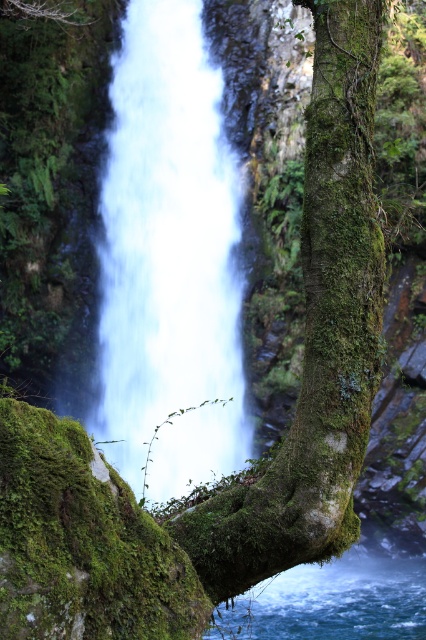
Between white frothy water at center and clear blue water at lower center, which one is positioned lower?

clear blue water at lower center

The height and width of the screenshot is (640, 426). Describe the element at coordinates (169, 259) in the screenshot. I see `white frothy water at center` at that location.

Between point (196, 326) and point (359, 570), which one is positioned in front?

Point (359, 570) is in front.

The width and height of the screenshot is (426, 640). I want to click on white frothy water at center, so click(169, 259).

Does white frothy water at center have a lesser height compared to green mossy tree trunk at center?

Correct, white frothy water at center is not as tall as green mossy tree trunk at center.

Who is positioned more to the left, white frothy water at center or green mossy tree trunk at center?

From the viewer's perspective, white frothy water at center appears more on the left side.

The height and width of the screenshot is (640, 426). I want to click on white frothy water at center, so click(x=169, y=259).

Identify the location of white frothy water at center. This screenshot has height=640, width=426. pos(169,259).

Which is behind, point (314, 545) or point (244, 595)?

The point (244, 595) is more distant.

Is green mossy tree trunk at center further to camera compared to clear blue water at lower center?

That is False.

Does point (198, 520) lie in front of point (258, 596)?

Yes, point (198, 520) is closer to viewer.

Identify the location of green mossy tree trunk at center. (316, 333).